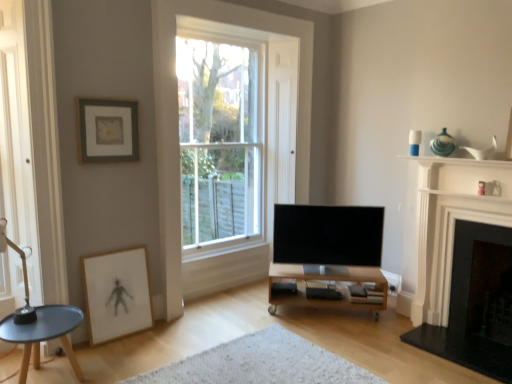
Where is `empty space that is ontop of matte black coffee table at lower left (from a real-world perspective)`? This screenshot has height=384, width=512. empty space that is ontop of matte black coffee table at lower left (from a real-world perspective) is located at coordinates (42, 324).